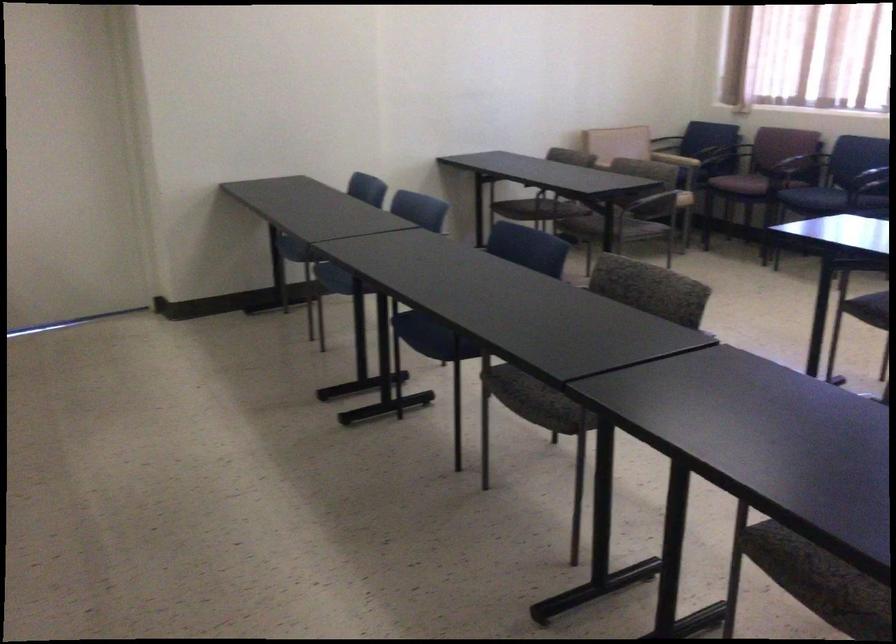
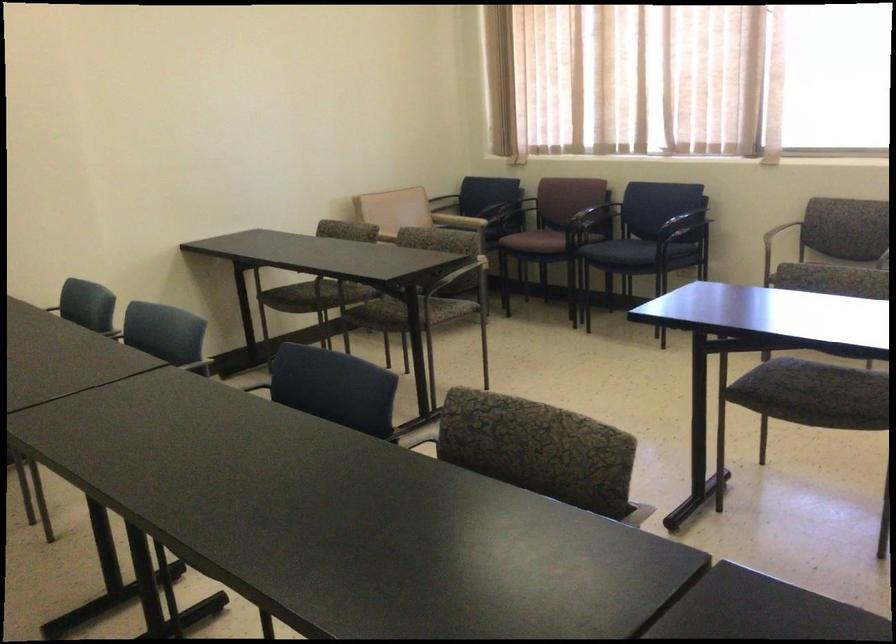
The point at (661, 294) is marked in the first image. Where is the corresponding point in the second image?

(538, 449)